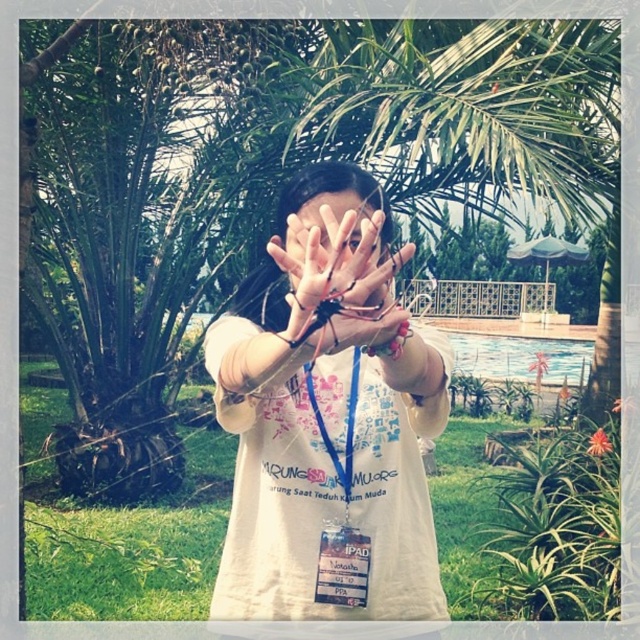
Describe the element at coordinates (328, 419) in the screenshot. I see `white matte shirt at center` at that location.

Who is positioned more to the right, white matte shirt at center or matte skin hand at center?

From the viewer's perspective, matte skin hand at center appears more on the right side.

Is point (305, 512) positioned before point (342, 216)?

That is False.

Locate an element on the screen. white matte shirt at center is located at coordinates (328, 419).

Which is above, green leafy palm tree at center or white matte shirt at center?

Positioned higher is green leafy palm tree at center.

Can you confirm if green leafy palm tree at center is positioned above white matte shirt at center?

Yes.

Measure the distance between point [61,339] and camera.

Point [61,339] is 4.91 meters from camera.

At what (x,y) coordinates should I click in order to perform the action: click on green leafy palm tree at center. Please return your answer as a coordinate pair (x, y). The height and width of the screenshot is (640, 640). Looking at the image, I should click on (264, 177).

Who is higher up, green leafy palm tree at center or matte skin hand at center?

Positioned higher is green leafy palm tree at center.

Can you confirm if green leafy palm tree at center is taller than matte skin hand at center?

Yes, green leafy palm tree at center is taller than matte skin hand at center.

What are the coordinates of `green leafy palm tree at center` in the screenshot? It's located at (264, 177).